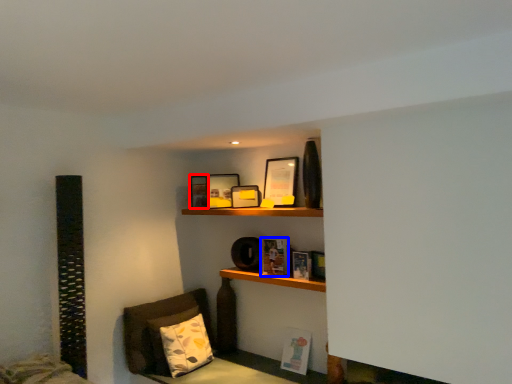
Question: Which of the following is the farthest to the observer, picture frame (highlighted by a red box) or book (highlighted by a blue box)?

Choices:
 (A) picture frame
 (B) book

Answer: (A)